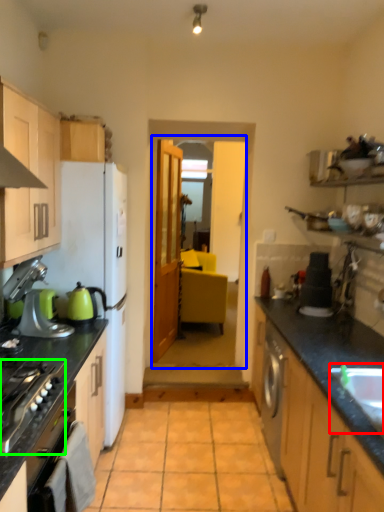
Question: Considering the real-world distances, which object is farthest from sink (highlighted by a red box)? glass door (highlighted by a blue box) or home appliance (highlighted by a green box)?

Choices:
 (A) glass door
 (B) home appliance

Answer: (A)